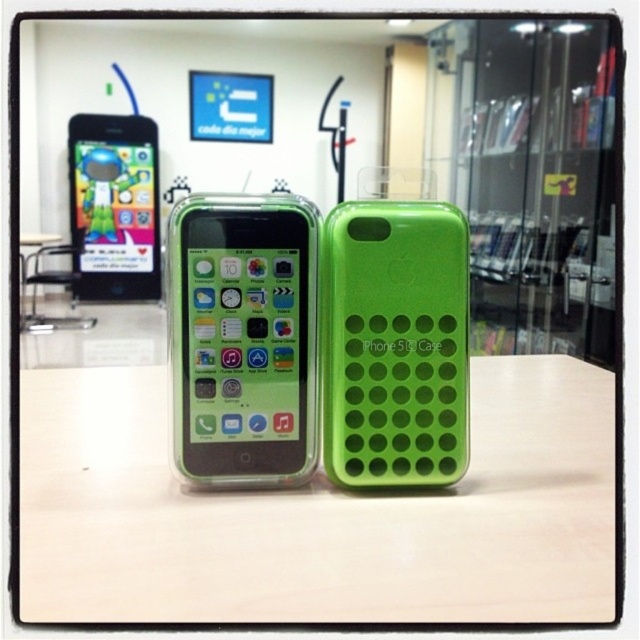
Does green matte smartphone at center have a lesser width compared to green matte iphone case at center?

Correct, green matte smartphone at center's width is less than green matte iphone case at center's.

Between point (260, 339) and point (440, 387), which one is positioned behind?

The point (440, 387) is more distant.

The height and width of the screenshot is (640, 640). I want to click on green matte smartphone at center, so click(243, 337).

Which is in front, point (131, 512) or point (452, 259)?

Point (131, 512) is more forward.

Is point (362, 528) positioned in front of point (435, 484)?

Yes, point (362, 528) is in front of point (435, 484).

You are a GUI agent. You are given a task and a screenshot of the screen. Output one action in this format:
    pyautogui.click(x=<x>, y=<y>)
    Task: Click on the white matte table at center
    This screenshot has height=640, width=640.
    Given the screenshot: What is the action you would take?
    pyautogui.click(x=317, y=515)

The width and height of the screenshot is (640, 640). Identify the location of white matte table at center. (317, 515).

Between white matte table at center and green matte smartphone at center, which one is positioned higher?

green matte smartphone at center is higher up.

Is point (429, 497) closer to camera compared to point (234, 241)?

No, it is not.

The image size is (640, 640). What are the coordinates of `white matte table at center` in the screenshot? It's located at (317, 515).